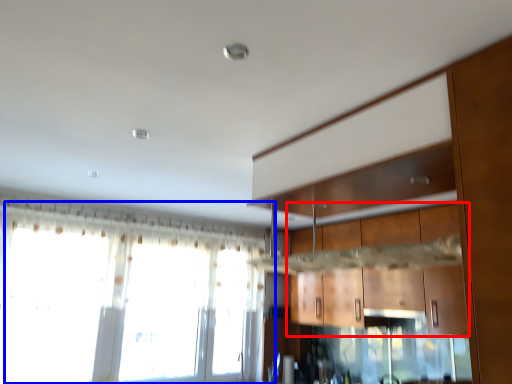
Question: Which object appears farthest to the camera in this image, cabinetry (highlighted by a red box) or window (highlighted by a blue box)?

Choices:
 (A) cabinetry
 (B) window

Answer: (B)